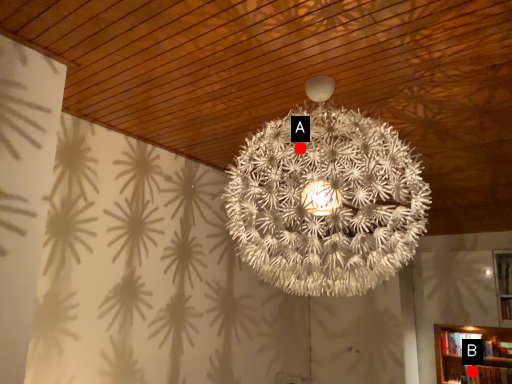
Question: Two points are circled on the image, labeled by A and B beside each circle. Which point is further to the camera?

Choices:
 (A) A is further
 (B) B is further

Answer: (B)